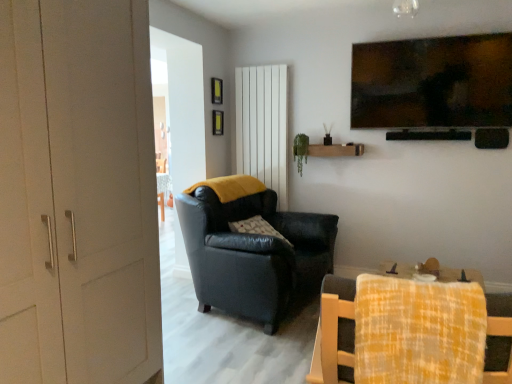
Find the location of a particular element. The height and width of the screenshot is (384, 512). white vertical panel at center is located at coordinates (263, 126).

What do you see at coordinates (77, 194) in the screenshot?
I see `white matte door at left` at bounding box center [77, 194].

Image resolution: width=512 pixels, height=384 pixels. I want to click on plush gray pillow at center, so click(x=257, y=228).

From a real-world perspective, is yellow plaid fabric at lower right, which is the first chair in front-to-back order, physically located above or below plush gray pillow at center?

yellow plaid fabric at lower right, which is the first chair in front-to-back order, is situated higher than plush gray pillow at center in the real world.

Does yellow plaid fabric at lower right, arranged as the 2th chair when viewed from the back, touch plush gray pillow at center?

yellow plaid fabric at lower right, arranged as the 2th chair when viewed from the back, and plush gray pillow at center are clearly separated.

Is yellow plaid fabric at lower right, arranged as the 2th chair when viewed from the back, oriented away from plush gray pillow at center?

yellow plaid fabric at lower right, arranged as the 2th chair when viewed from the back, does not have its back to plush gray pillow at center.

From the image's perspective, which one is positioned lower, white matte door at left or plush gray pillow at center?

plush gray pillow at center is shown below in the image.

Could plush gray pillow at center be considered to be inside white matte door at left?

That's incorrect, plush gray pillow at center is not inside white matte door at left.

Image resolution: width=512 pixels, height=384 pixels. Find the location of `pillow below the white matte door at left (from a real-world perspective)`. pillow below the white matte door at left (from a real-world perspective) is located at coordinates (257, 228).

Would you say white matte door at left is a long distance from plush gray pillow at center?

Yes.

Is leather armchair at center, which ranks as the second chair in front-to-back order, at the right side of white matte door at left?

Yes.

Considering the sizes of objects leather armchair at center, which ranks as the 1th chair in back-to-front order, and white matte door at left in the image provided, who is bigger, leather armchair at center, which ranks as the 1th chair in back-to-front order, or white matte door at left?

With larger size is white matte door at left.

Relative to white matte door at left, is leather armchair at center, which ranks as the 1th chair in back-to-front order, in front or behind?

In the image, leather armchair at center, which ranks as the 1th chair in back-to-front order, appears behind white matte door at left.

In the scene shown: From the image's perspective, is white matte door at left beneath white vertical panel at center?

Correct, white matte door at left appears lower than white vertical panel at center in the image.

Which is more to the left, white matte door at left or white vertical panel at center?

white matte door at left.

Image resolution: width=512 pixels, height=384 pixels. Identify the location of door lying below the white vertical panel at center (from the image's perspective). (77, 194).

Is plush gray pillow at center next to yellow plaid fabric at lower right, which is the first chair in front-to-back order?

No.

Where is `chair on the right of plush gray pillow at center`? This screenshot has height=384, width=512. chair on the right of plush gray pillow at center is located at coordinates (334, 333).

Is plush gray pillow at center thinner than yellow plaid fabric at lower right, arranged as the 2th chair when viewed from the back?

Incorrect, the width of plush gray pillow at center is not less than that of yellow plaid fabric at lower right, arranged as the 2th chair when viewed from the back.

Could you tell me if plush gray pillow at center is facing yellow plaid fabric at lower right, which is the first chair in front-to-back order?

No.

Is point (254, 234) farther from camera compared to point (277, 108)?

No, it is not.

Who is taller, leather armchair at center, which ranks as the second chair in front-to-back order, or white vertical panel at center?

white vertical panel at center is taller.

Is leather armchair at center, which ranks as the second chair in front-to-back order, to the right of white vertical panel at center from the viewer's perspective?

No.

This screenshot has height=384, width=512. Identify the location of curtain above the leather armchair at center, which ranks as the second chair in front-to-back order (from a real-world perspective). (263, 126).

From a real-world perspective, is white vertical panel at center located beneath leather armchair at center, which ranks as the 1th chair in back-to-front order?

Incorrect, from a real-world perspective, white vertical panel at center is higher than leather armchair at center, which ranks as the 1th chair in back-to-front order.

Who is smaller, white vertical panel at center or leather armchair at center, which ranks as the second chair in front-to-back order?

Smaller between the two is white vertical panel at center.

Is white vertical panel at center at the left side of leather armchair at center, which ranks as the second chair in front-to-back order?

Incorrect, white vertical panel at center is not on the left side of leather armchair at center, which ranks as the second chair in front-to-back order.

Which of these two, white vertical panel at center or leather armchair at center, which ranks as the 1th chair in back-to-front order, is thinner?

white vertical panel at center is thinner.

Identify the location of pillow that appears on the left of yellow plaid fabric at lower right, arranged as the 2th chair when viewed from the back. Image resolution: width=512 pixels, height=384 pixels. (257, 228).

Find the location of a particular element. pillow lying below the white matte door at left (from the image's perspective) is located at coordinates (257, 228).

Considering their positions, is leather armchair at center, which ranks as the second chair in front-to-back order, positioned further to plush gray pillow at center than white vertical panel at center?

Based on the image, white vertical panel at center appears to be further to plush gray pillow at center.

Considering their positions, is plush gray pillow at center positioned further to white vertical panel at center than white matte door at left?

The object further to white vertical panel at center is white matte door at left.

Looking at the image, which one is located closer to white vertical panel at center, yellow plaid fabric at lower right, which is the first chair in front-to-back order, or leather armchair at center, which ranks as the 1th chair in back-to-front order?

The object closer to white vertical panel at center is leather armchair at center, which ranks as the 1th chair in back-to-front order.

When comparing their distances from white matte door at left, does white vertical panel at center or yellow plaid fabric at lower right, which is the first chair in front-to-back order, seem further?

The object further to white matte door at left is white vertical panel at center.

Considering their positions, is yellow plaid fabric at lower right, which is the first chair in front-to-back order, positioned closer to plush gray pillow at center than white vertical panel at center?

white vertical panel at center is closer to plush gray pillow at center.

From the image, which object appears to be nearer to plush gray pillow at center, leather armchair at center, which ranks as the second chair in front-to-back order, or yellow plaid fabric at lower right, which is the first chair in front-to-back order?

leather armchair at center, which ranks as the second chair in front-to-back order, is closer to plush gray pillow at center.

Estimate the real-world distances between objects in this image. Which object is further from white matte door at left, white vertical panel at center or leather armchair at center, which ranks as the 1th chair in back-to-front order?

white vertical panel at center.

Consider the image. Considering their positions, is yellow plaid fabric at lower right, which is the first chair in front-to-back order, positioned further to white matte door at left than leather armchair at center, which ranks as the 1th chair in back-to-front order?

Based on the image, leather armchair at center, which ranks as the 1th chair in back-to-front order, appears to be further to white matte door at left.

Find the location of a particular element. The height and width of the screenshot is (384, 512). pillow positioned between white matte door at left and white vertical panel at center from near to far is located at coordinates (257, 228).

Locate an element on the screen. Image resolution: width=512 pixels, height=384 pixels. pillow positioned between leather armchair at center, which ranks as the second chair in front-to-back order, and white vertical panel at center from near to far is located at coordinates (257, 228).

Locate an element on the screen. pillow located between yellow plaid fabric at lower right, which is the first chair in front-to-back order, and white vertical panel at center in the depth direction is located at coordinates (257, 228).

In order to click on door located between yellow plaid fabric at lower right, which is the first chair in front-to-back order, and leather armchair at center, which ranks as the second chair in front-to-back order, in the depth direction in this screenshot , I will do `click(77, 194)`.